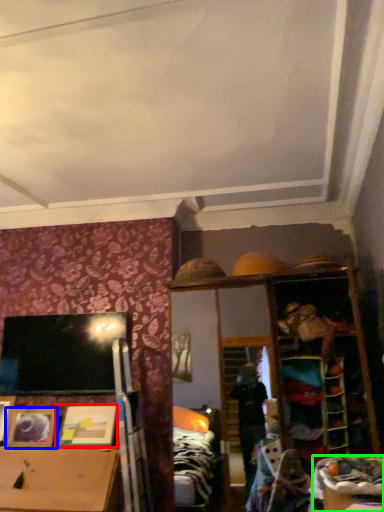
Question: Which object is the farthest from picture frame (highlighted by a red box)? Choose among these: picture frame (highlighted by a blue box) or table (highlighted by a green box).

Choices:
 (A) picture frame
 (B) table

Answer: (B)